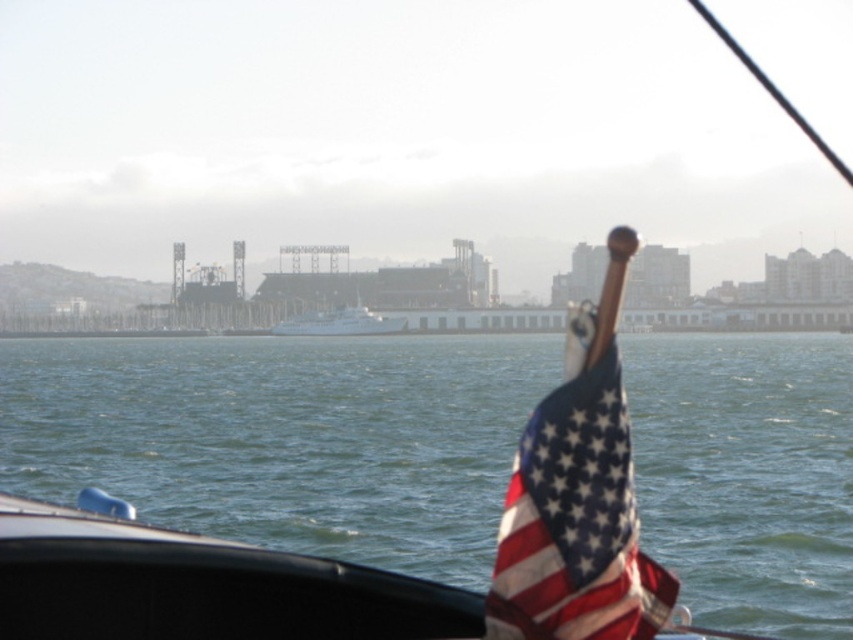
Can you confirm if green water at lower center is smaller than white glossy boat at center?

Incorrect, green water at lower center is not smaller in size than white glossy boat at center.

Find the location of a particular element. The image size is (853, 640). green water at lower center is located at coordinates (x=283, y=435).

Which is in front, point (341, 476) or point (328, 326)?

Point (341, 476) is more forward.

What are the coordinates of `green water at lower center` in the screenshot? It's located at (283, 435).

Between point (589, 554) and point (318, 324), which one is positioned in front?

Point (589, 554) is in front.

Is american flag at right shorter than white glossy boat at center?

Yes.

Locate an element on the screen. american flag at right is located at coordinates (576, 518).

Is green water at lower center below american flag at right?

Indeed, green water at lower center is positioned under american flag at right.

Between green water at lower center and american flag at right, which one has less height?

american flag at right is shorter.

At what (x,y) coordinates should I click in order to perform the action: click on green water at lower center. Please return your answer as a coordinate pair (x, y). The image size is (853, 640). Looking at the image, I should click on (283, 435).